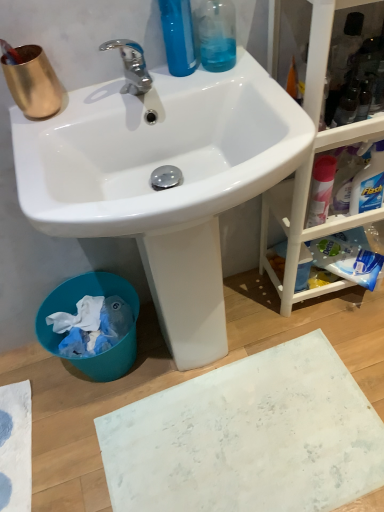
You are a GUI agent. You are given a task and a screenshot of the screen. Output one action in this format:
    pyautogui.click(x=<x>, y=<y>)
    Task: Click on the vacant space in white glossy sink at upper center (from a real-world perspective)
    Image resolution: width=384 pixels, height=512 pixels.
    Given the screenshot: What is the action you would take?
    pyautogui.click(x=224, y=356)